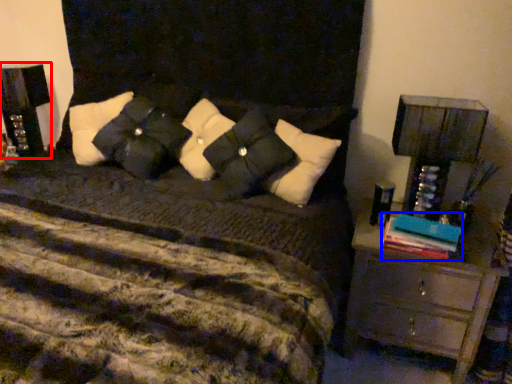
Question: Which of the following is the farthest to the observer, nightstand (highlighted by a red box) or book (highlighted by a blue box)?

Choices:
 (A) nightstand
 (B) book

Answer: (A)